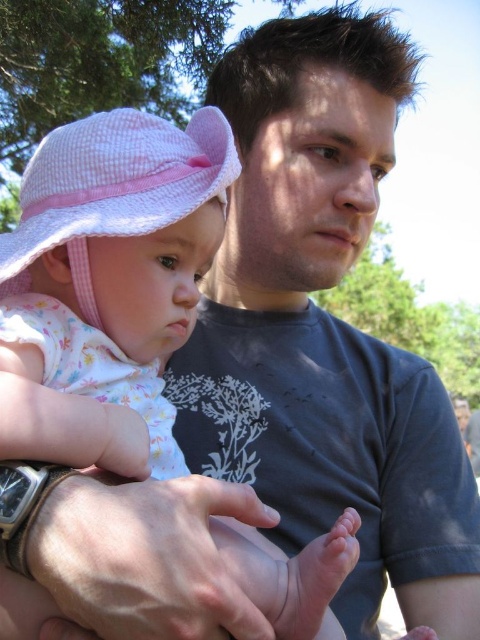
Does pink gingham hat at upper left have a lesser height compared to pink seersucker hat at left?

Incorrect, pink gingham hat at upper left's height does not fall short of pink seersucker hat at left's.

Which is in front, point (66, 461) or point (108, 145)?

Point (66, 461)

Between point (101, 385) and point (57, 156), which one is positioned behind?

Point (101, 385)

Identify the location of pink gingham hat at upper left. This screenshot has height=640, width=480. (107, 285).